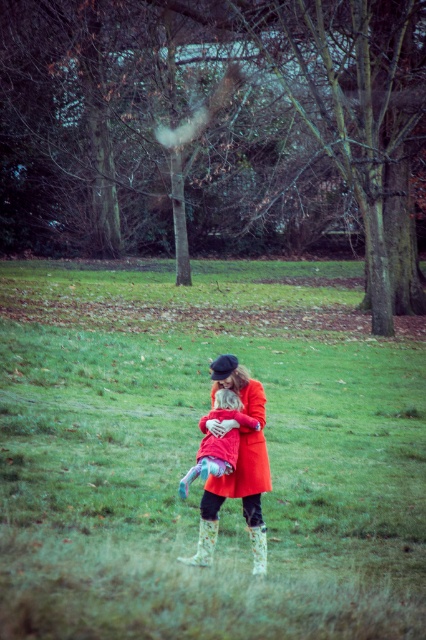
Who is higher up, matte orange coat at center or white floral rubber boot at lower center?

matte orange coat at center

Does point (262, 422) lie behind point (207, 548)?

No, it is not.

Does point (259, 381) lie in front of point (196, 563)?

No, (259, 381) is behind (196, 563).

Where is `matte orange coat at center`? The image size is (426, 640). matte orange coat at center is located at coordinates (236, 467).

Does matte orange coat at center come in front of fluffy pink coat at center?

No, matte orange coat at center is further to the viewer.

Is matte orange coat at center bigger than fluffy pink coat at center?

Indeed, matte orange coat at center has a larger size compared to fluffy pink coat at center.

This screenshot has height=640, width=426. Describe the element at coordinates (236, 467) in the screenshot. I see `matte orange coat at center` at that location.

What are the coordinates of `matte orange coat at center` in the screenshot? It's located at (236, 467).

Can you confirm if green grassy field at center is positioned below fluffy pink coat at center?

Actually, green grassy field at center is above fluffy pink coat at center.

Measure the distance between point (267, 387) and camera.

They are 43.64 feet apart.

This screenshot has width=426, height=640. I want to click on green grassy field at center, so click(195, 449).